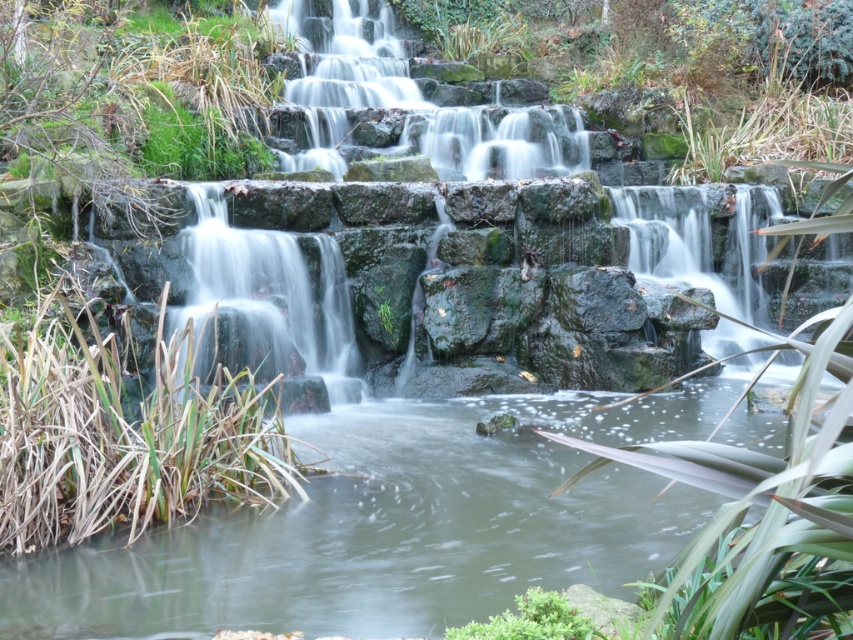
You are standing at the edge of the waterfall and want to cross to the other side. You see the clear water at center and the green mossy rock at upper center. Which object should you step on to avoid getting wet?

You should step on the green mossy rock at upper center because the clear water at center is positioned to its right side, meaning the rock is higher up and less likely to be submerged in the flowing water.

You are a hiker who wants to cross the waterfall area safely. You see the clear water at center and the green mossy rock at upper center. Which object is lower and thus safer to step on to avoid getting wet?

The clear water at center has a lesser height compared to green mossy rock at upper center, so stepping on the clear water at center would be lower and safer to avoid getting wet.